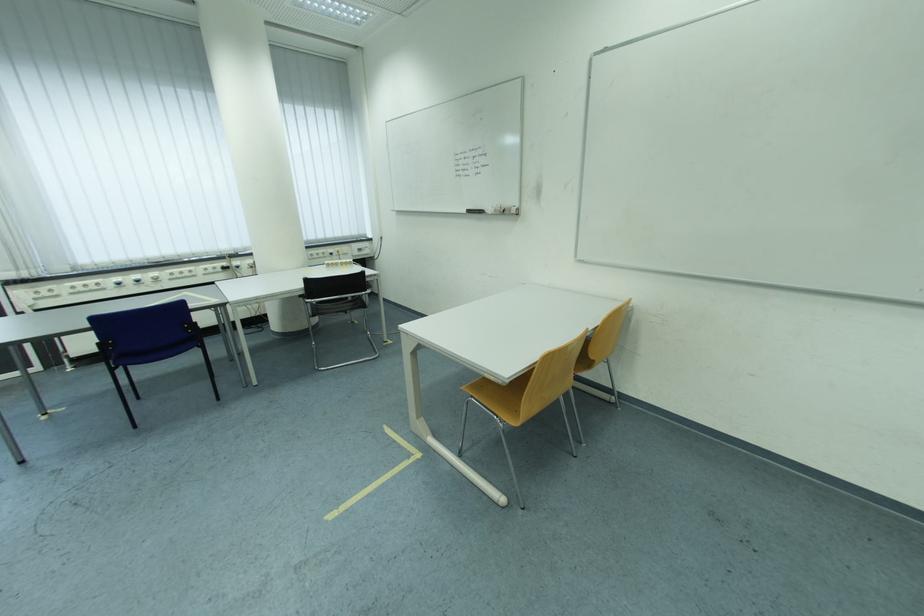
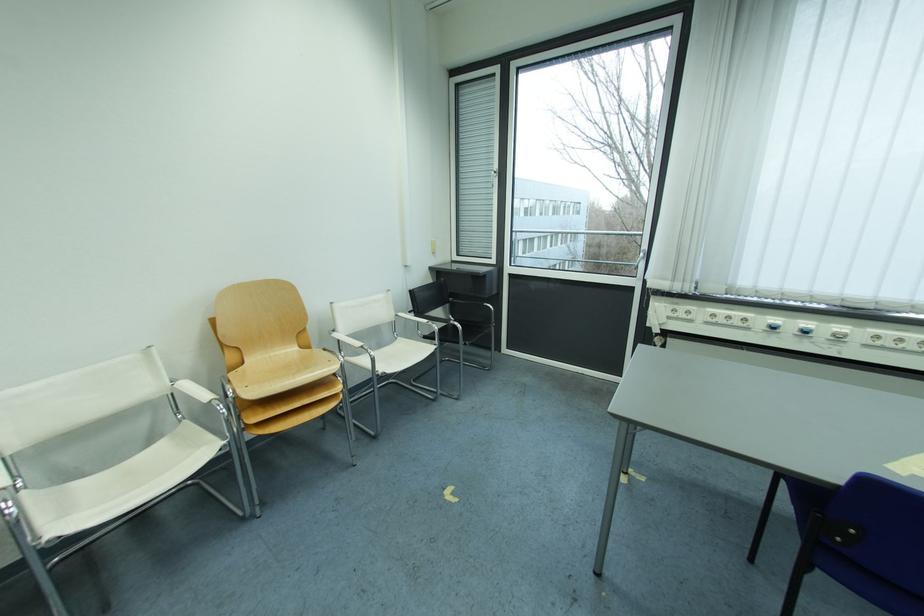
The point at (144,278) is marked in the first image. Where is the corresponding point in the second image?

(816, 326)